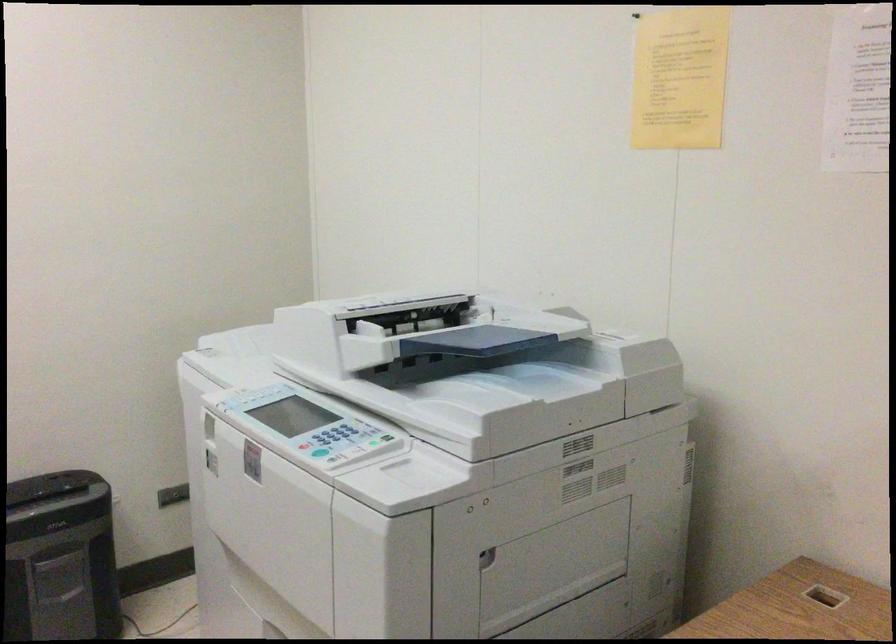
Where would you insert the shredder paper slot? Please return your answer as a coordinate pair (x, y).

(552, 567)